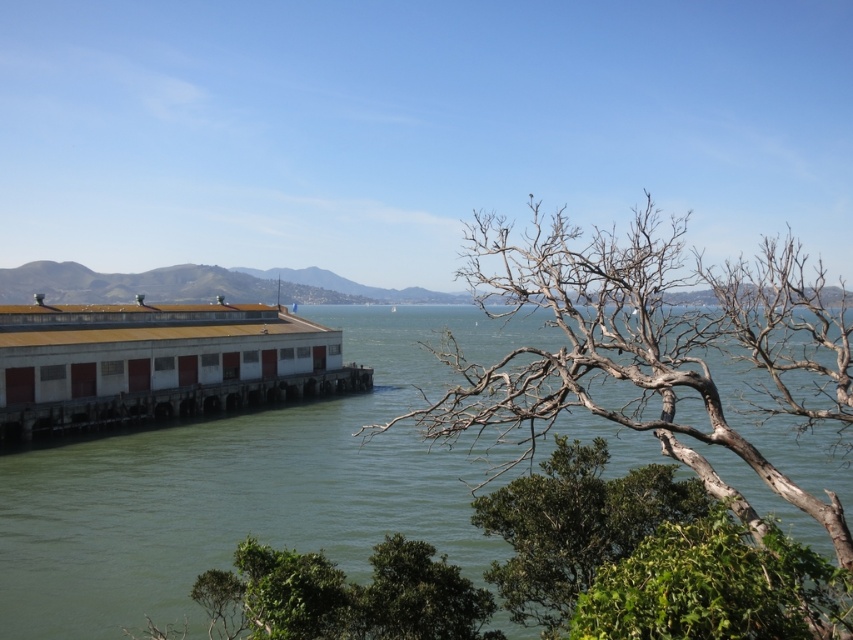
Question: Based on their relative distances, which object is nearer to the green leafy tree at lower right?

Choices:
 (A) white matte dock at lower left
 (B) green water at lower left

Answer: (B)

Question: Does green water at lower left appear on the left side of green leafy tree at lower right?

Choices:
 (A) yes
 (B) no

Answer: (B)

Question: Does bare wood tree at lower right appear under green leafy tree at lower right?

Choices:
 (A) yes
 (B) no

Answer: (B)

Question: Which of the following is the farthest from the observer?

Choices:
 (A) white matte dock at lower left
 (B) bare wood tree at lower right
 (C) green water at lower left

Answer: (A)

Question: Which object appears farthest from the camera in this image?

Choices:
 (A) green leafy tree at lower right
 (B) white matte dock at lower left
 (C) green water at lower left
 (D) bare wood tree at lower right

Answer: (B)

Question: Does green water at lower left appear over white matte dock at lower left?

Choices:
 (A) no
 (B) yes

Answer: (A)